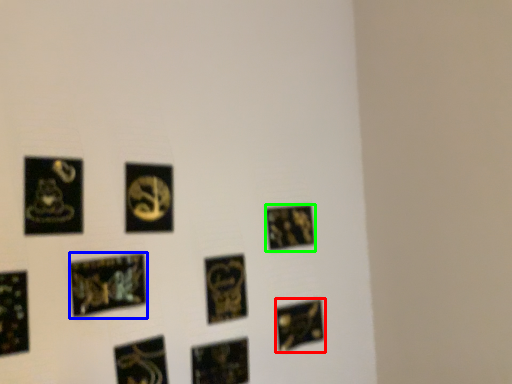
Question: Which object is positioned farthest from picture frame (highlighted by a red box)? Select from picture frame (highlighted by a blue box) and picture frame (highlighted by a green box).

Choices:
 (A) picture frame
 (B) picture frame

Answer: (A)